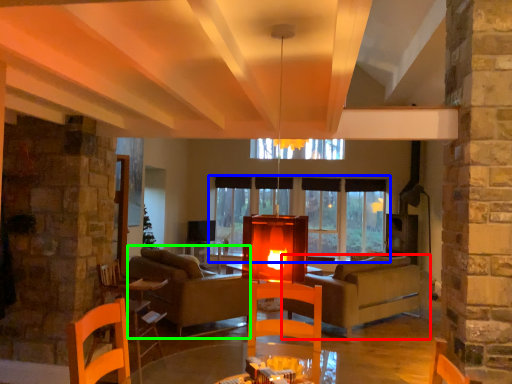
Question: Which object is positioned closest to studio couch (highlighted by a red box)? Select from window (highlighted by a blue box) and couch (highlighted by a green box).

Choices:
 (A) window
 (B) couch

Answer: (A)